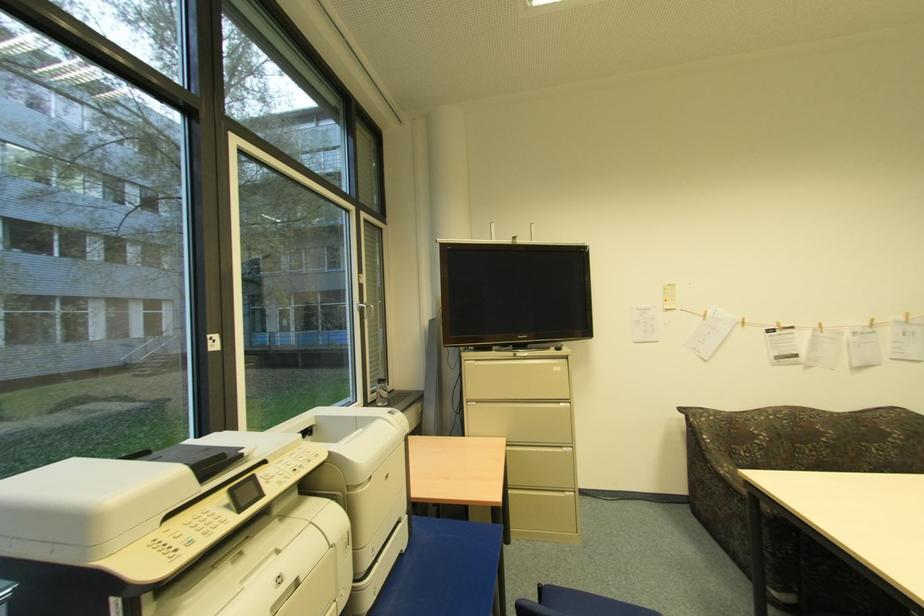
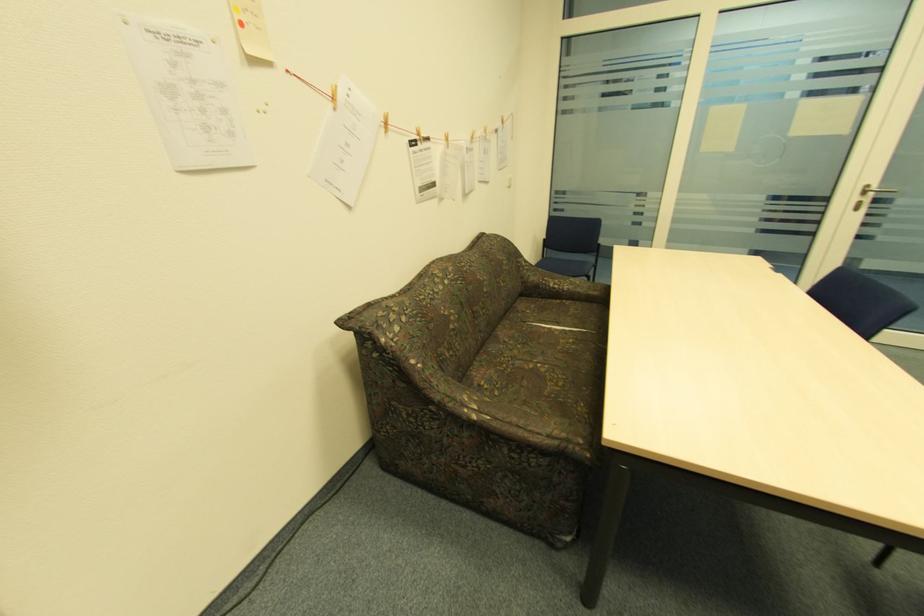
Locate, in the second image, the point that corresponds to point (779, 328) in the first image.

(420, 138)